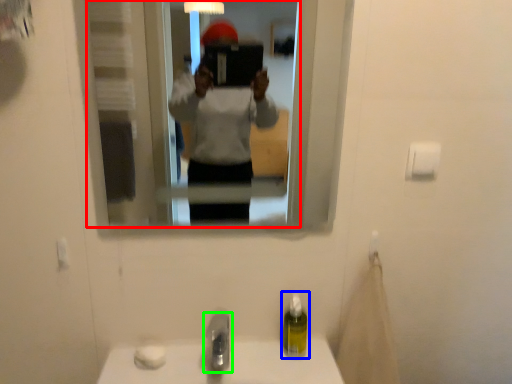
Question: Considering the real-world distances, which object is farthest from mirror (highlighted by a red box)? soap dispenser (highlighted by a blue box) or tap (highlighted by a green box)?

Choices:
 (A) soap dispenser
 (B) tap

Answer: (A)